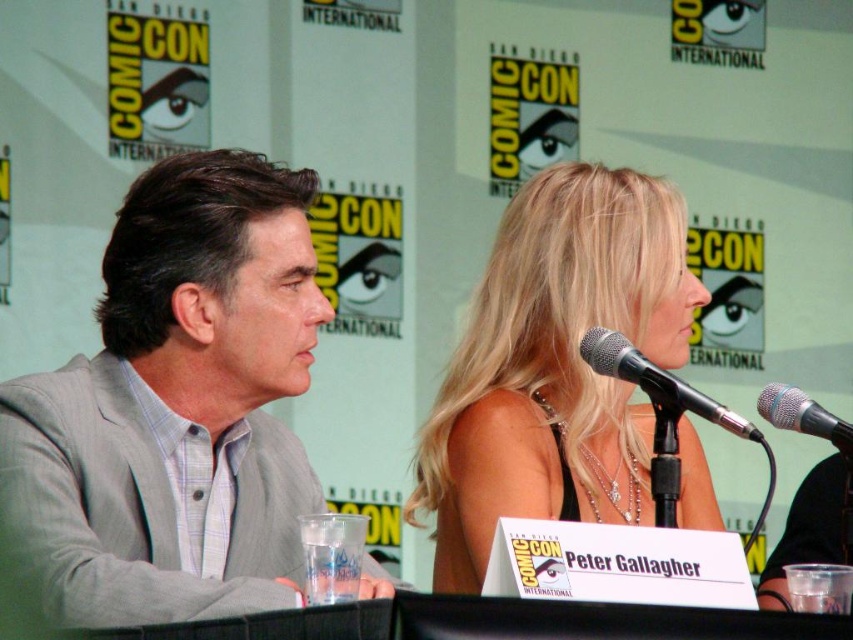
You are attending Comic Con and want to take a photo of the blonde hair at center. Where should you position yourself to capture it in the frame?

To capture the blonde hair at center in the frame, position yourself so that the center of your camera aligns with the coordinates approximately at point 0.572 on the x axis and 0.652 on the y axis.

You are a sound technician at Comic Con who needs to adjust the distance between the black metallic microphone at upper center and the silver metallic microphone at right to 10 inches. Based on the current setup shown in the image, should you move them closer together or farther apart?

The current distance between the black metallic microphone at upper center and the silver metallic microphone at right is 8.16 inches. To reach the desired 10 inches, you need to move them farther apart.

You are a sound technician at Comic Con and you need to place a new microphone stand between the black metallic microphone at upper center and the silver metallic microphone at right. Which microphone should you place the stand closer to if the stand requires more space due to its width?

The black metallic microphone at upper center might be wider than the silver metallic microphone at right, so you should place the stand closer to the black metallic microphone at upper center to accommodate its width.